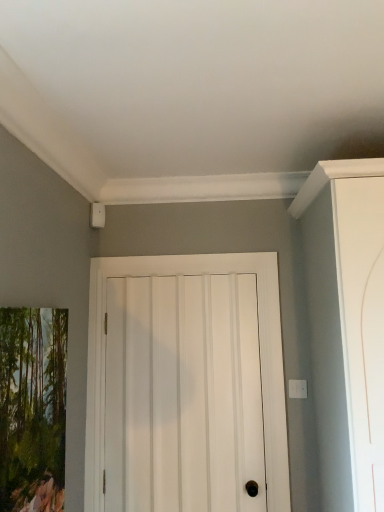
Question: From the image's perspective, does white matte door at center appear lower than matte wooden picture frame at left?

Choices:
 (A) no
 (B) yes

Answer: (B)

Question: From a real-world perspective, is white matte door at center positioned under matte wooden picture frame at left based on gravity?

Choices:
 (A) no
 (B) yes

Answer: (B)

Question: Is white matte door at center further to the viewer compared to matte wooden picture frame at left?

Choices:
 (A) yes
 (B) no

Answer: (A)

Question: Is matte wooden picture frame at left a part of white matte door at center?

Choices:
 (A) no
 (B) yes

Answer: (A)

Question: Can you see white matte door at center touching matte wooden picture frame at left?

Choices:
 (A) yes
 (B) no

Answer: (B)

Question: Is white matte door at center turned away from matte wooden picture frame at left?

Choices:
 (A) yes
 (B) no

Answer: (B)

Question: From the image's perspective, would you say matte wooden picture frame at left is positioned over white matte door at center?

Choices:
 (A) yes
 (B) no

Answer: (A)

Question: Does matte wooden picture frame at left touch white matte door at center?

Choices:
 (A) no
 (B) yes

Answer: (A)

Question: Does matte wooden picture frame at left have a greater height compared to white matte door at center?

Choices:
 (A) yes
 (B) no

Answer: (B)

Question: From a real-world perspective, is matte wooden picture frame at left over white matte door at center?

Choices:
 (A) no
 (B) yes

Answer: (B)

Question: Is matte wooden picture frame at left aimed at white matte door at center?

Choices:
 (A) no
 (B) yes

Answer: (A)

Question: Would you say white matte door at center is part of matte wooden picture frame at left's contents?

Choices:
 (A) yes
 (B) no

Answer: (B)

Question: Considering the positions of white matte door at center and matte wooden picture frame at left in the image, is white matte door at center taller or shorter than matte wooden picture frame at left?

Choices:
 (A) tall
 (B) short

Answer: (A)